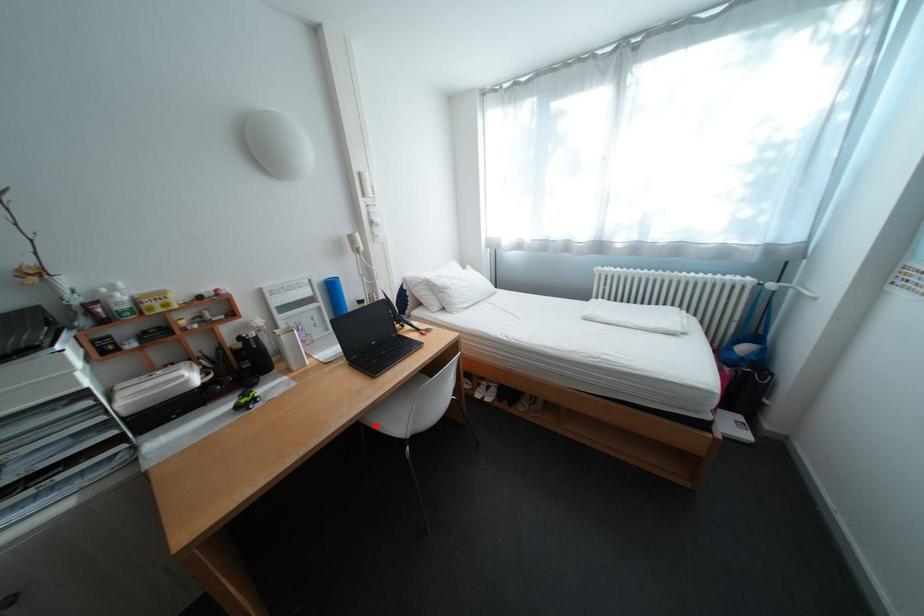
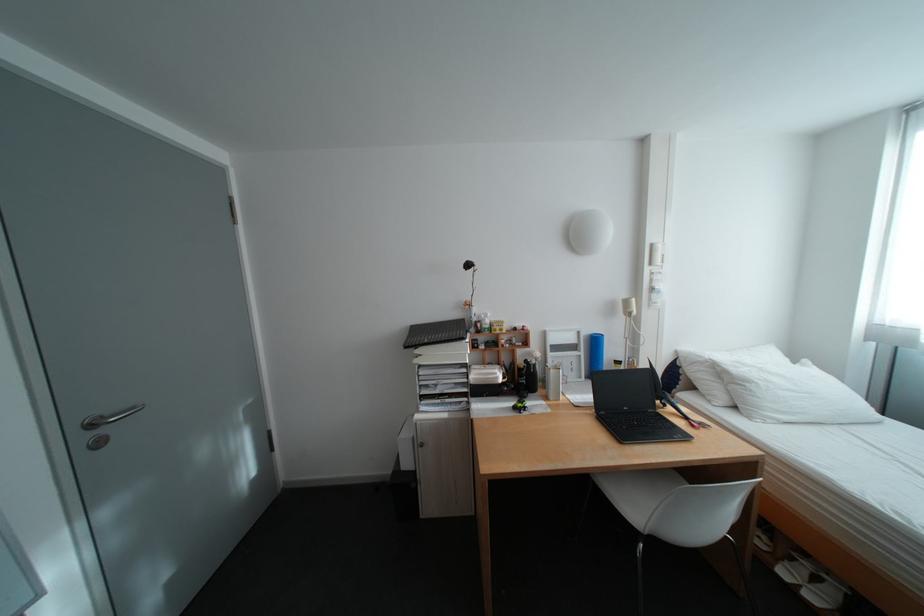
Where in the second image is the point corresponding to the highlighted location from the first image?

(606, 483)